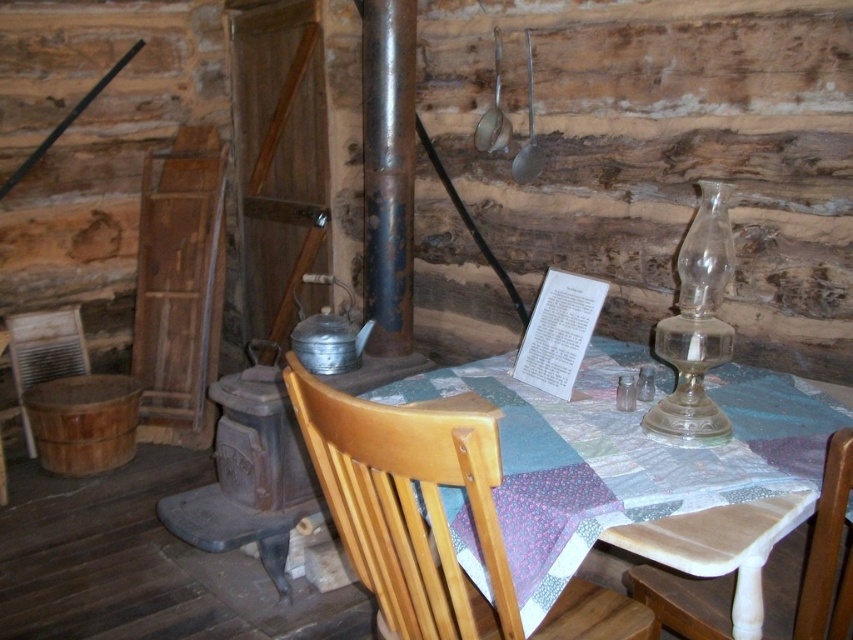
You are standing in the rustic cabin and need to place a decorative item on the quilted fabric table at center. Given its position at coordinates 0.723, 0.743, can you confirm if this table is positioned closer to the right side or the left side of the room?

The quilted fabric table at center is located at point (x=633, y=461), which indicates it is positioned closer to the right side of the room based on standard coordinate systems where higher x values correspond to the right side.

You are standing in the cabin and want to reach the point marked at coordinates [463,483]. If your arm can extend 30 inches, can you reach it without moving?

The point at coordinates [463,483] is 35.48 inches away from the camera. Since your arm can only extend 30 inches, you cannot reach it without moving.

You are a guest in this rustic cabin and need to place a small decorative item on the quilted fabric table at center. Considering the size of the light brown wood chair at center, will the table have enough space for the item?

The quilted fabric table at center has a larger size compared to the light brown wood chair at center, so it should have sufficient space to place the small decorative item.